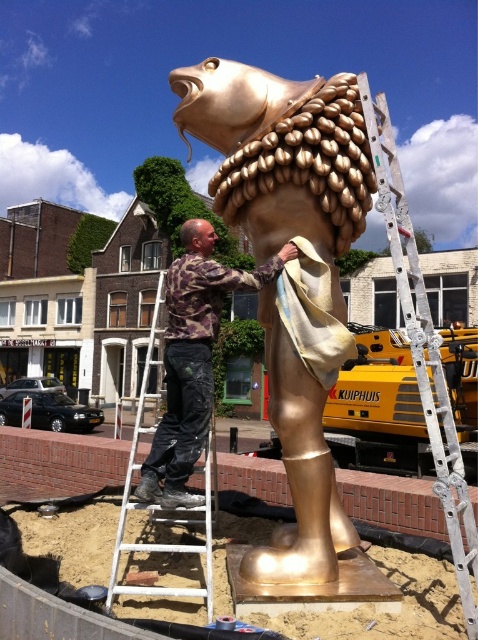
This screenshot has height=640, width=478. What do you see at coordinates (423, 349) in the screenshot?
I see `white metallic ladder at center` at bounding box center [423, 349].

Who is more distant from viewer, [448,518] or [207,451]?

Positioned behind is point [207,451].

Does point (415, 284) come in front of point (206, 586)?

Yes.

At what (x,y) coordinates should I click in order to perform the action: click on white metallic ladder at center. Please return your answer as a coordinate pair (x, y). The width and height of the screenshot is (478, 640). Looking at the image, I should click on (423, 349).

Is gold metallic fish at center further to the viewer compared to white metallic ladder at center?

Yes, gold metallic fish at center is behind white metallic ladder at center.

Is gold metallic fish at center thinner than white metallic ladder at center?

Yes.

Is point (322, 577) farther from camera compared to point (470, 547)?

That is True.

Where is `gold metallic fish at center`? gold metallic fish at center is located at coordinates (286, 275).

Is gold metallic fish at center shorter than white metal ladder at center?

Yes.

Consider the image. Who is lower down, gold metallic fish at center or white metal ladder at center?

white metal ladder at center is below.

Where is `gold metallic fish at center`? Image resolution: width=478 pixels, height=640 pixels. gold metallic fish at center is located at coordinates (286, 275).